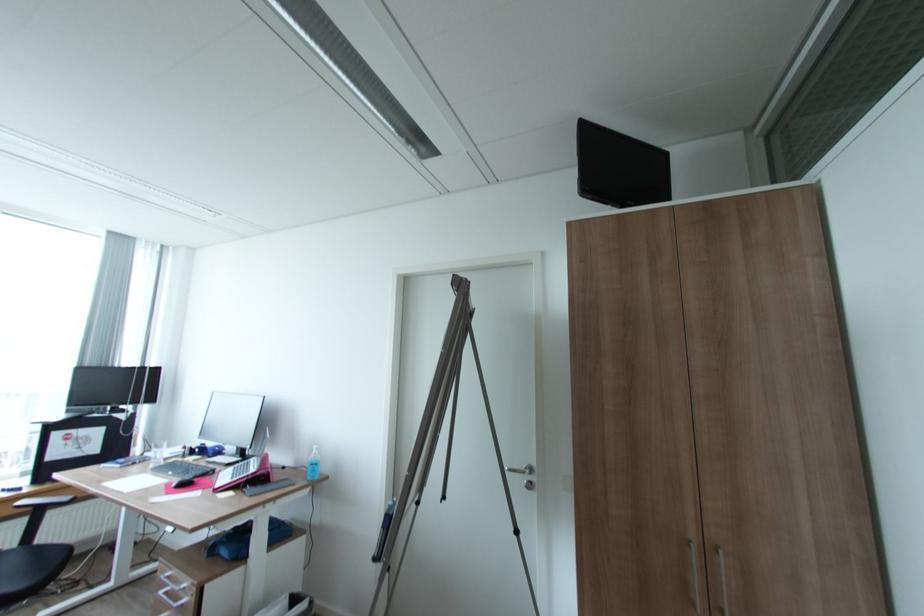
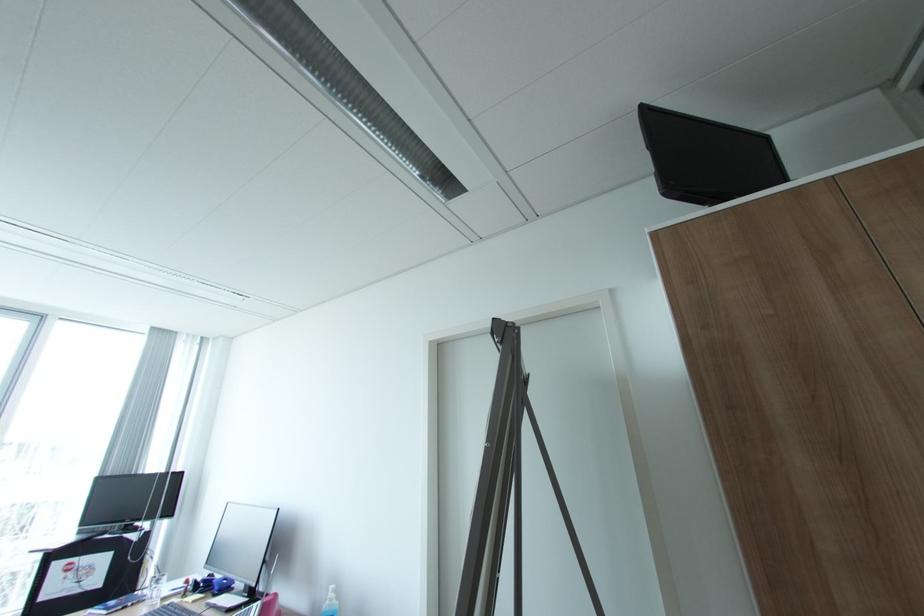
Find the pixel in the second image that matches pixel 320 454 in the first image.

(336, 599)